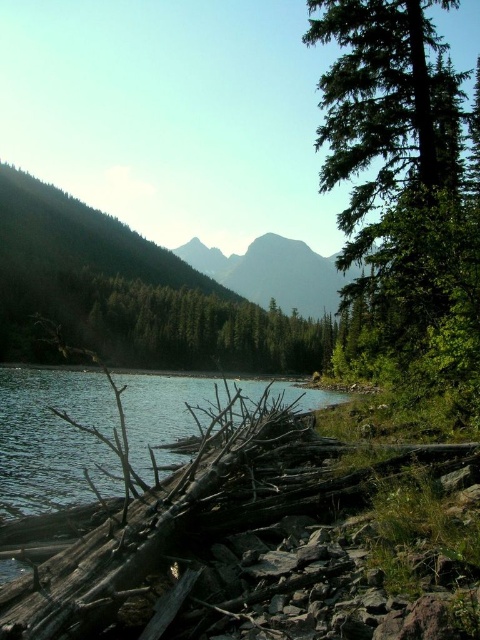
Question: Does green matte tree at center appear over smooth gray mountain at center?

Choices:
 (A) no
 (B) yes

Answer: (A)

Question: Is green textured tree at right to the right of green matte tree at center from the viewer's perspective?

Choices:
 (A) yes
 (B) no

Answer: (A)

Question: Which point is farther to the camera?

Choices:
 (A) (187, 244)
 (B) (175, 352)
 (C) (324, 42)

Answer: (A)

Question: Is green textured tree at right positioned behind smooth gray mountain at center?

Choices:
 (A) yes
 (B) no

Answer: (B)

Question: Which of these objects is positioned closest to the green matte tree at center?

Choices:
 (A) smooth gray mountain at center
 (B) green textured tree at right

Answer: (B)

Question: Which of the following is the farthest from the observer?

Choices:
 (A) green matte tree at center
 (B) smooth gray mountain at center
 (C) green textured tree at right

Answer: (A)